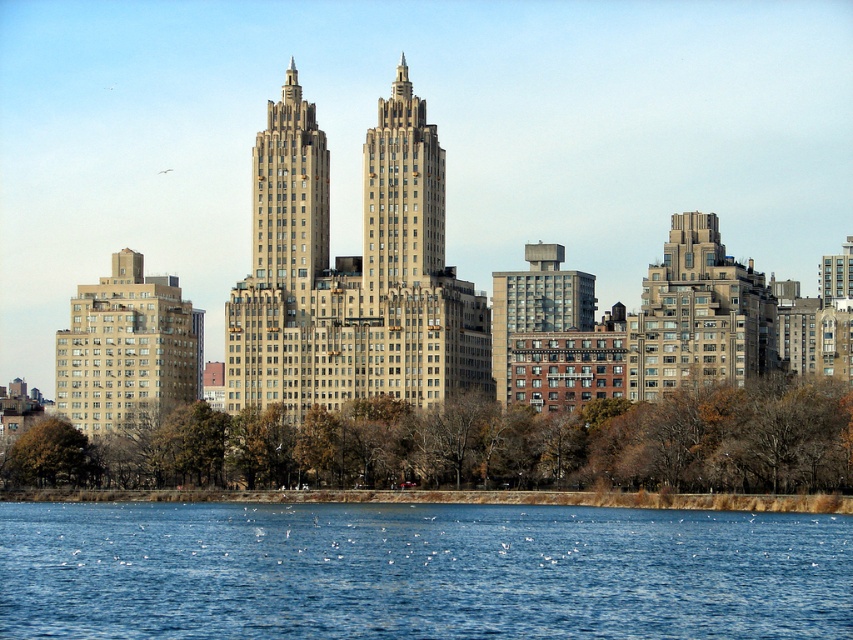
Can you confirm if blue liquid water at lower center is shorter than beige stone twin towers at center?

Yes, blue liquid water at lower center is shorter than beige stone twin towers at center.

Can you confirm if blue liquid water at lower center is positioned above beige stone twin towers at center?

Incorrect, blue liquid water at lower center is not positioned above beige stone twin towers at center.

Which is in front, point (589, 563) or point (335, 284)?

Point (589, 563) is more forward.

The image size is (853, 640). I want to click on blue liquid water at lower center, so click(419, 572).

Which of these two, beige concrete building at left or brown brick building at center, stands taller?

With more height is beige concrete building at left.

Can you confirm if beige concrete building at left is taller than brown brick building at center?

Yes, beige concrete building at left is taller than brown brick building at center.

This screenshot has height=640, width=853. Identify the location of beige concrete building at left. (126, 349).

You are a GUI agent. You are given a task and a screenshot of the screen. Output one action in this format:
    pyautogui.click(x=<x>, y=<y>)
    Task: Click on the beige concrete building at left
    
    Given the screenshot: What is the action you would take?
    pyautogui.click(x=126, y=349)

Is the position of blue liquid water at lower center more distant than that of beige concrete building at left?

No, it is not.

Can you confirm if blue liquid water at lower center is positioned to the left of beige concrete building at left?

Incorrect, blue liquid water at lower center is not on the left side of beige concrete building at left.

Image resolution: width=853 pixels, height=640 pixels. I want to click on blue liquid water at lower center, so click(x=419, y=572).